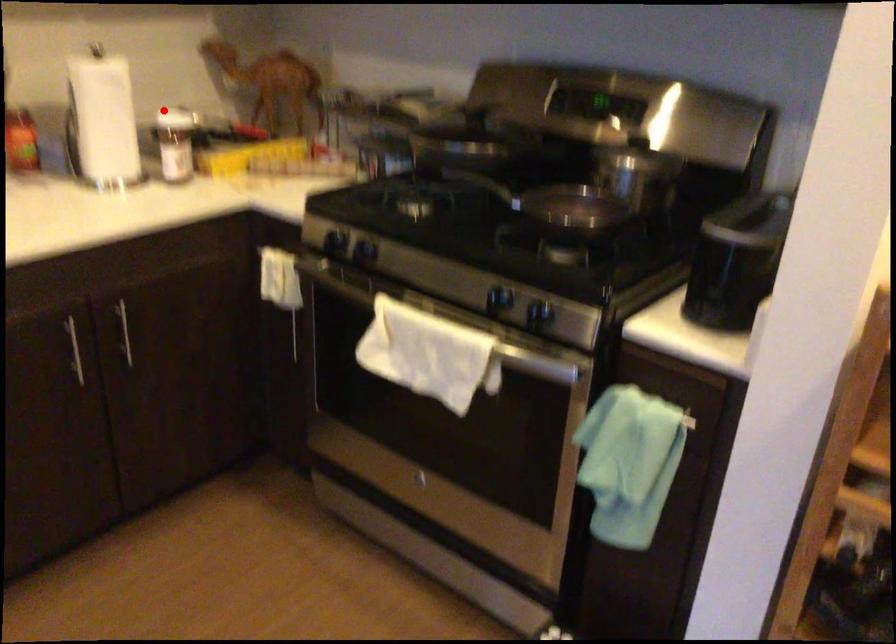
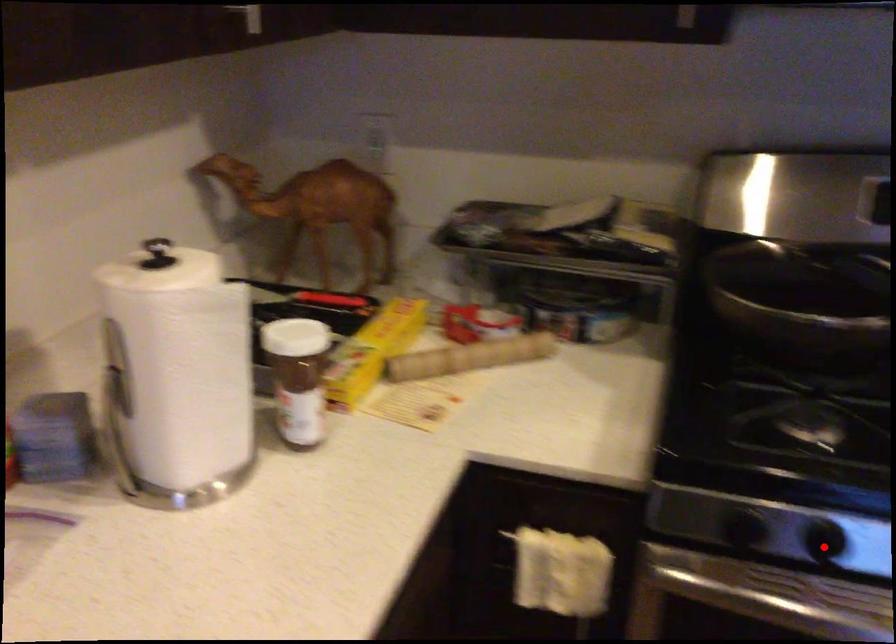
I am providing you with two images of the same scene from different viewpoints. A red point is marked on the first image and another point is marked on the second image. Are the points marked in image1 and image2 representing the same 3D position?

No